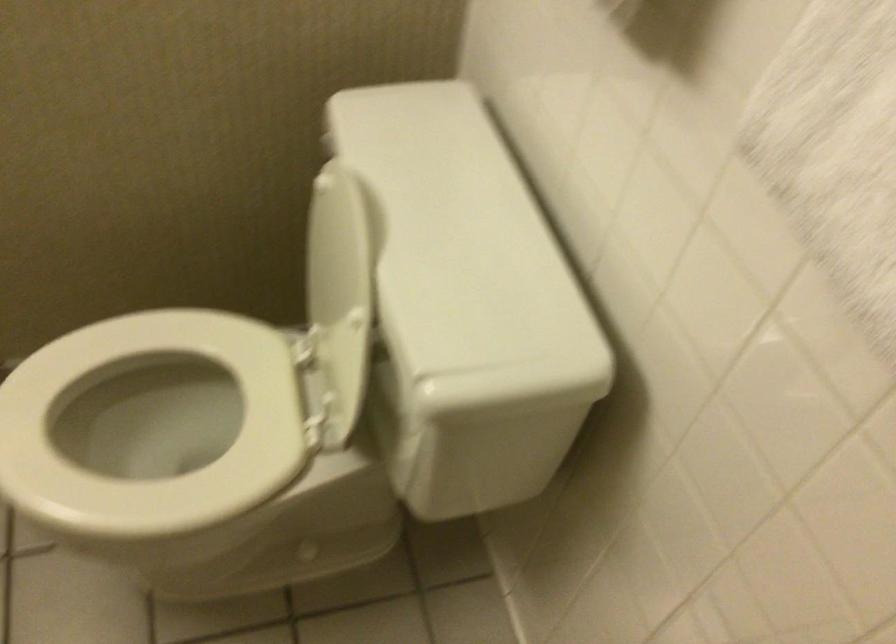
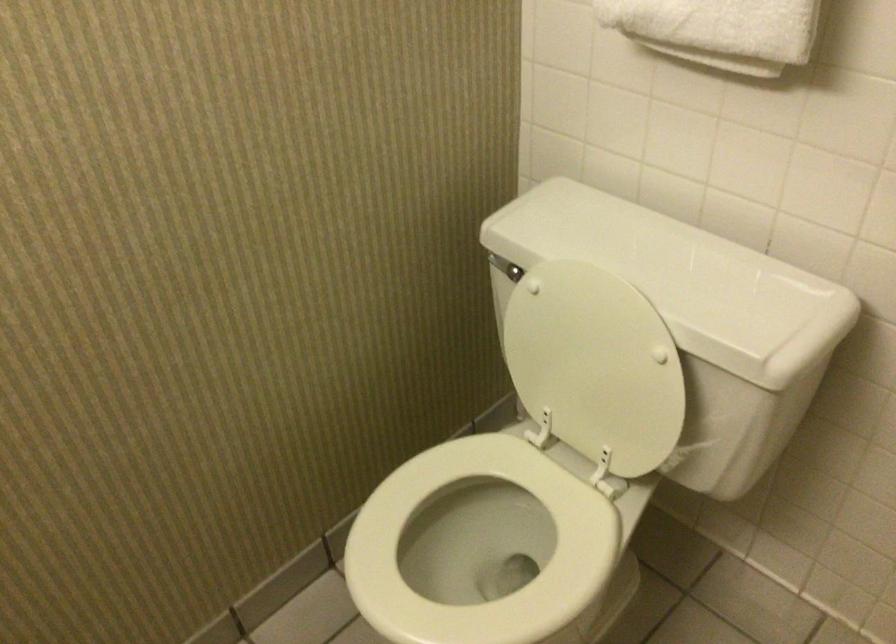
Question: Based on the continuous images, in which direction is the camera rotating? Reply with the corresponding letter.

Choices:
 (A) Left
 (B) Right
 (C) Up
 (D) Down

Answer: (B)